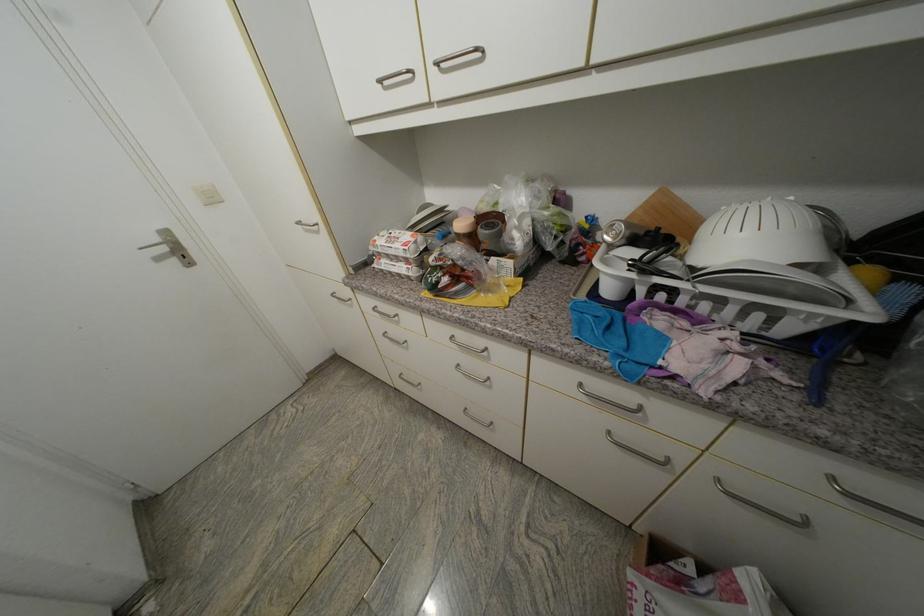
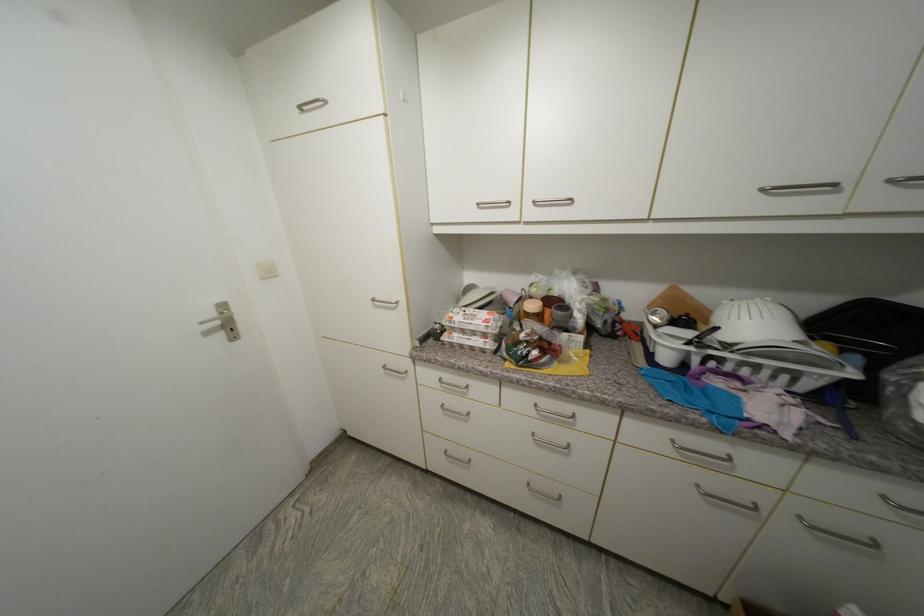
Where in the second image is the point corresponding to the point at 337,296 from the first image?

(390, 369)